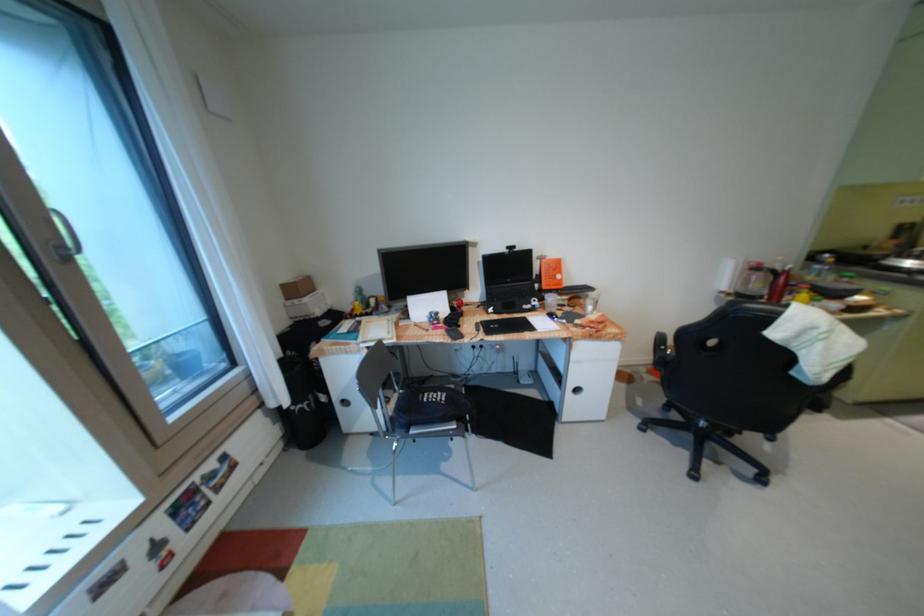
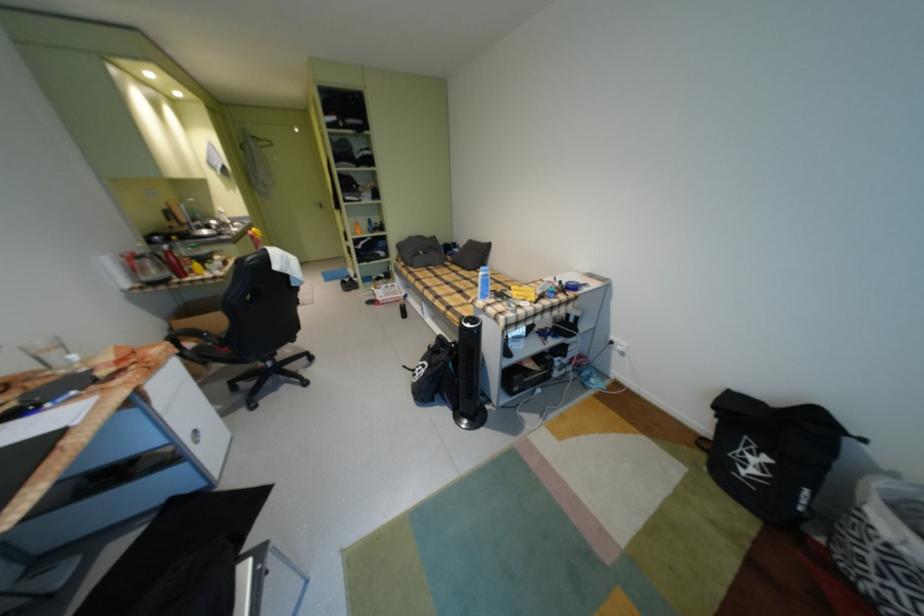
Locate, in the second image, the point that corresponds to [712,424] in the first image.

(280, 365)